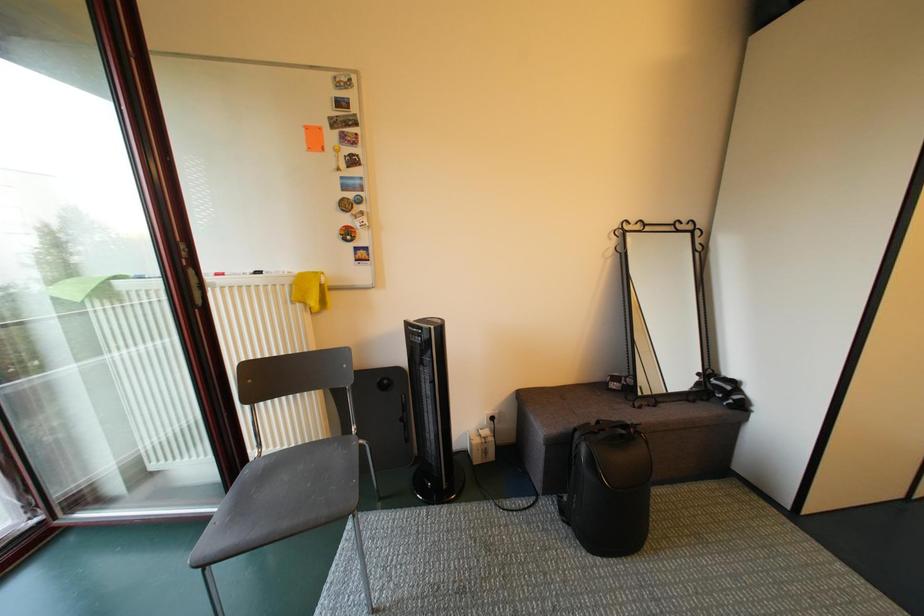
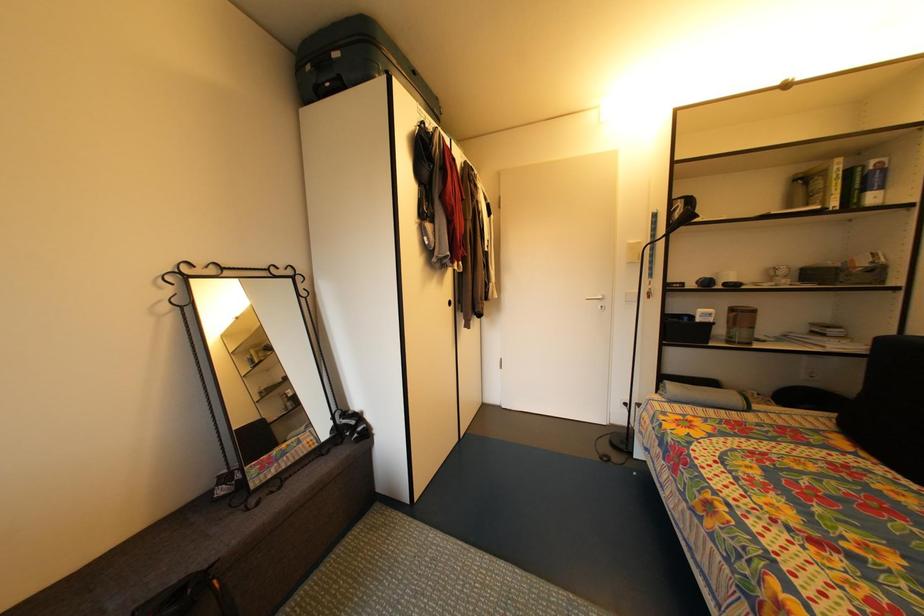
Question: The camera is either moving clockwise (left) or counter-clockwise (right) around the object. The first image is from the beginning of the video and the second image is from the end. Is the camera moving left or right when shooting the video?

Choices:
 (A) Left
 (B) Right

Answer: (A)